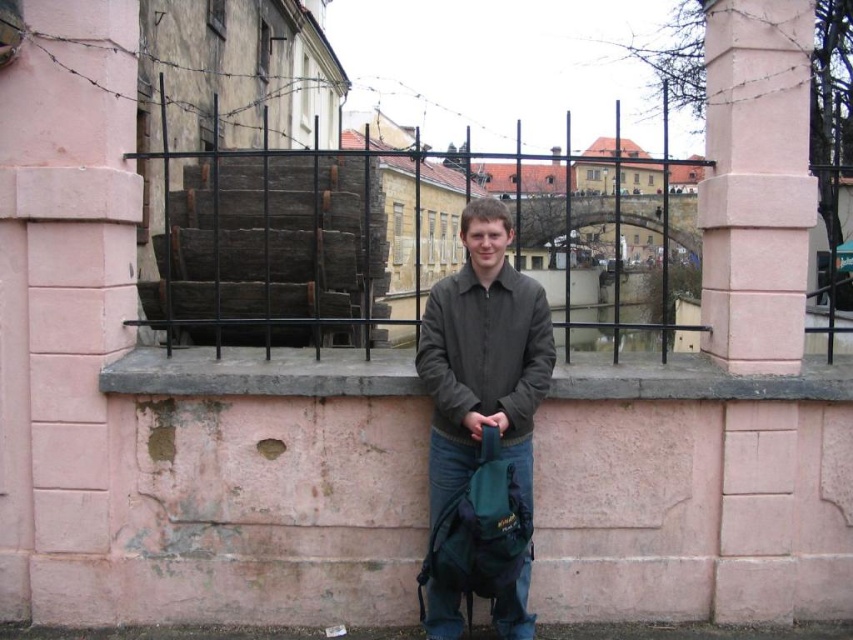
Is dark gray fabric jacket at center closer to the viewer compared to black metal fence at center?

Yes.

Is point (529, 356) positioned before point (364, 316)?

That is True.

This screenshot has width=853, height=640. What are the coordinates of `dark gray fabric jacket at center` in the screenshot? It's located at (482, 353).

Is pink stone pillar at center right wider than pink concrete ledge at center?

Yes, pink stone pillar at center right is wider than pink concrete ledge at center.

Is pink stone pillar at center right further to the viewer compared to pink concrete ledge at center?

Yes, pink stone pillar at center right is further from the viewer.

Identify the location of pink stone pillar at center right. This screenshot has width=853, height=640. (756, 182).

Identify the location of pink stone pillar at center right. The image size is (853, 640). (756, 182).

Who is taller, pink concrete ledge at center or black metal fence at center?

With more height is black metal fence at center.

Locate an element on the screen. The image size is (853, 640). pink concrete ledge at center is located at coordinates tap(260, 372).